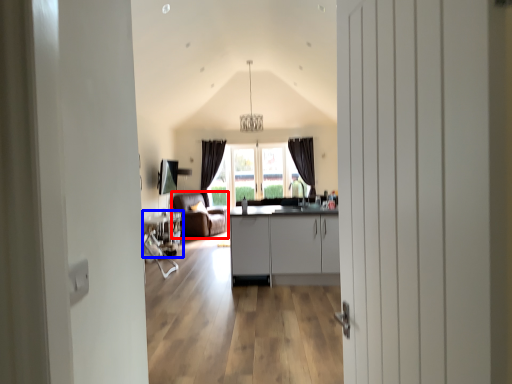
Question: Among these objects, which one is farthest to the camera, armchair (highlighted by a red box) or table (highlighted by a blue box)?

Choices:
 (A) armchair
 (B) table

Answer: (A)